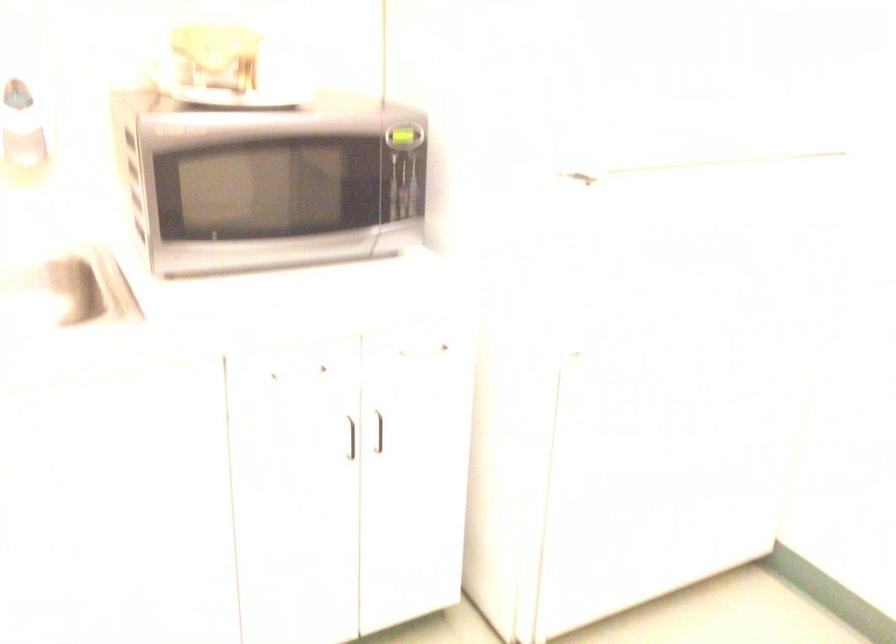
Describe the element at coordinates (399, 167) in the screenshot. The height and width of the screenshot is (644, 896). I see `the microwave door handle` at that location.